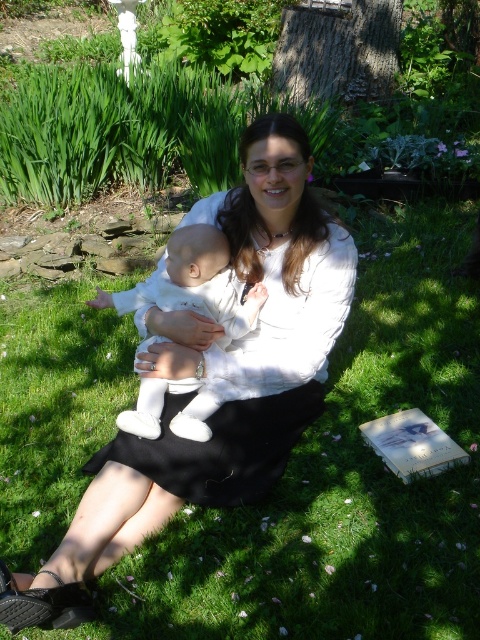
You are a photographer trying to place a decorative frame in the image. The frame must be placed exactly at the point with coordinates point (215, 380). Based on the scene description, where will this frame be placed?

The point (215, 380) is on white matte dress at center, so placing the frame there would position it on the white matte dress at center.

You are a photographer setting up a shoot in the garden. You have two dresses to place on the grass for a photoshoot. The white matte dress at center and the black matte dress at center. You need to ensure there is at least 5 centimeters between them for proper lighting. Can you place them according to the requirement?

The distance between the white matte dress at center and the black matte dress at center is exactly 5.05 centimeters, which meets the requirement of at least 5 centimeters. Therefore, they can be placed as specified.

Based on the photo, you are a photographer setting up for a portrait session. You have a client wearing the white matte dress at center and holding the white soft fabric baby at center. To ensure proper lighting, you need to know which object is closer to the camera. Based on the scene description, which one is closer?

The white soft fabric baby at center is closer to the camera because the white matte dress at center is positioned under it, indicating the baby is above and thus nearer to the viewer.